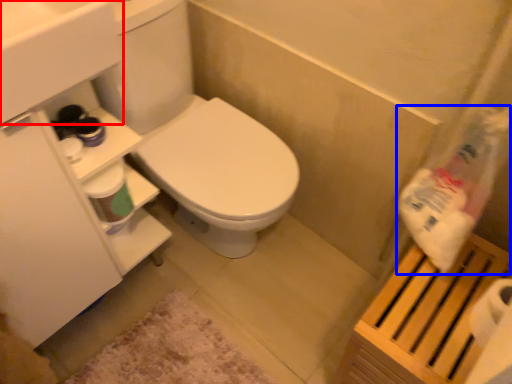
Question: Which point is further to the camera, sink (highlighted by a red box) or cleaning product (highlighted by a blue box)?

Choices:
 (A) sink
 (B) cleaning product

Answer: (B)